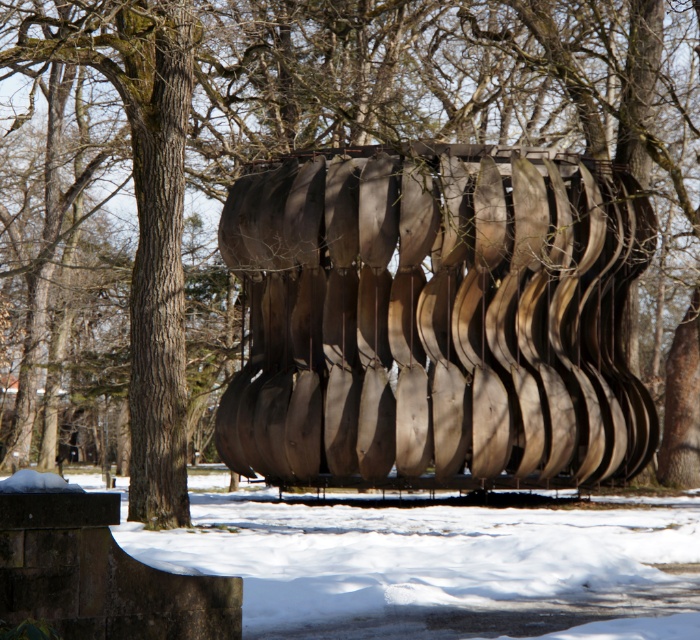
You are an artist planning to install a new sculpture in the park. You have a wooden sculpture at center and white powdery snow at lower center. Which object is shorter in height?

The wooden sculpture at center is not as tall as the white powdery snow at lower center, so the wooden sculpture at center is shorter in height.